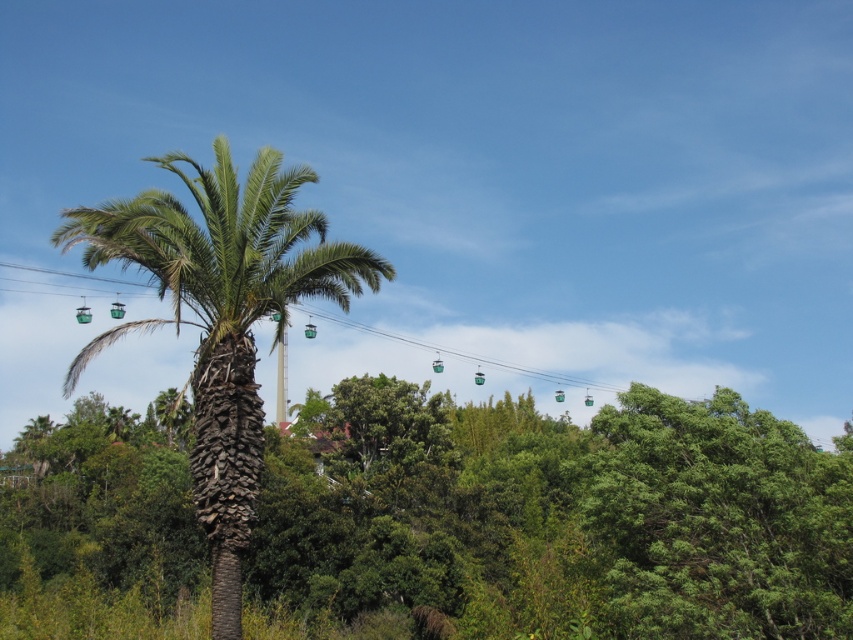
Question: Does green leafy tree at center lie in front of green cable car at center?

Choices:
 (A) yes
 (B) no

Answer: (A)

Question: Which of the following is the closest to the observer?

Choices:
 (A) green textured palm tree at center
 (B) green cable car at center

Answer: (A)

Question: Which point appears farthest from the camera in this image?

Choices:
 (A) (555, 378)
 (B) (201, 320)

Answer: (A)

Question: Is green leafy tree at center closer to the viewer compared to green textured palm tree at center?

Choices:
 (A) no
 (B) yes

Answer: (B)

Question: Does green leafy tree at center appear under green textured palm tree at center?

Choices:
 (A) yes
 (B) no

Answer: (A)

Question: Among these points, which one is farthest from the camera?

Choices:
 (A) (192, 611)
 (B) (526, 371)
 (C) (561, 378)

Answer: (C)